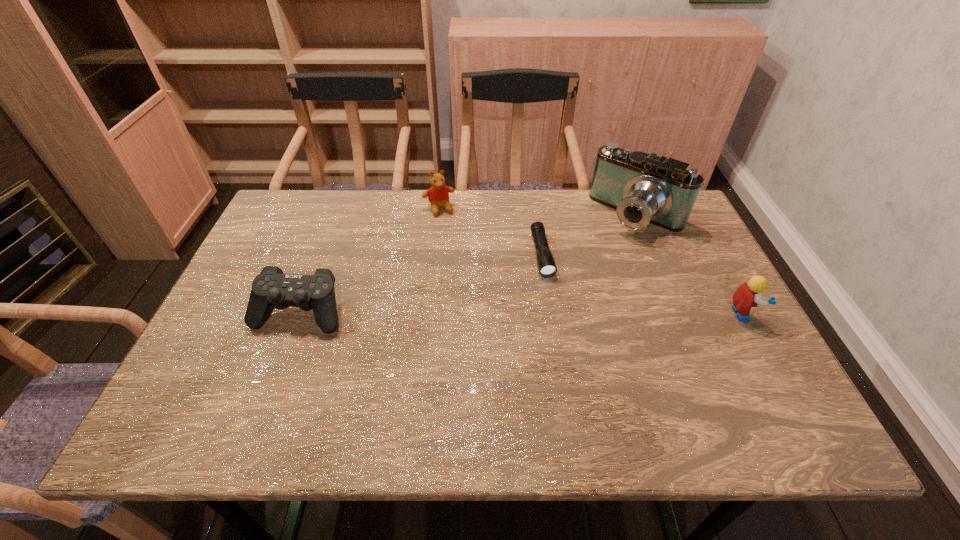
Where is `object that is the second closest to the Lego`? The height and width of the screenshot is (540, 960). object that is the second closest to the Lego is located at coordinates (547, 268).

Select which object is the third closest to the flashlight. Please provide its 2D coordinates. Your answer should be formatted as a tuple, i.e. [(x, y)], where the tuple contains the x and y coordinates of a point satisfying the conditions above.

[(748, 295)]

The image size is (960, 540). In order to click on vacant region that satisfies the following two spatial constraints: 1. on the front side of the tallest object; 2. on the front-facing side of the Lego in this screenshot , I will do `click(679, 314)`.

Where is `free spot that satisfies the following two spatial constraints: 1. on the front side of the leftmost object; 2. on the front-facing side of the Lego`? The height and width of the screenshot is (540, 960). free spot that satisfies the following two spatial constraints: 1. on the front side of the leftmost object; 2. on the front-facing side of the Lego is located at coordinates (300, 314).

At what (x,y) coordinates should I click in order to perform the action: click on free space that satisfies the following two spatial constraints: 1. on the front side of the Lego; 2. on the front-facing side of the tallest object. Please return your answer as a coordinate pair (x, y). This screenshot has width=960, height=540. Looking at the image, I should click on (679, 314).

Where is `free space in the image that satisfies the following two spatial constraints: 1. on the back side of the third object from left to right; 2. on the right side of the second shortest object`? The height and width of the screenshot is (540, 960). free space in the image that satisfies the following two spatial constraints: 1. on the back side of the third object from left to right; 2. on the right side of the second shortest object is located at coordinates (322, 254).

Locate an element on the screen. Image resolution: width=960 pixels, height=540 pixels. vacant point that satisfies the following two spatial constraints: 1. on the front side of the second object from left to right; 2. on the right side of the tallest object is located at coordinates (438, 214).